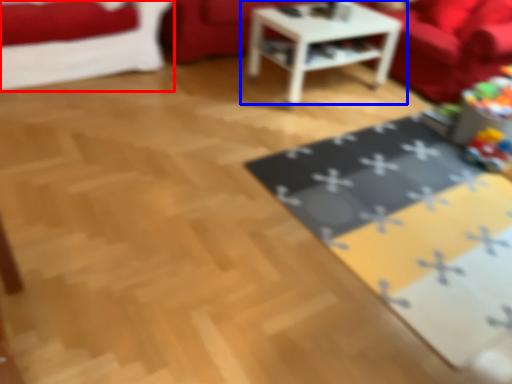
Question: Which object appears farthest to the camera in this image, studio couch (highlighted by a red box) or table (highlighted by a blue box)?

Choices:
 (A) studio couch
 (B) table

Answer: (B)